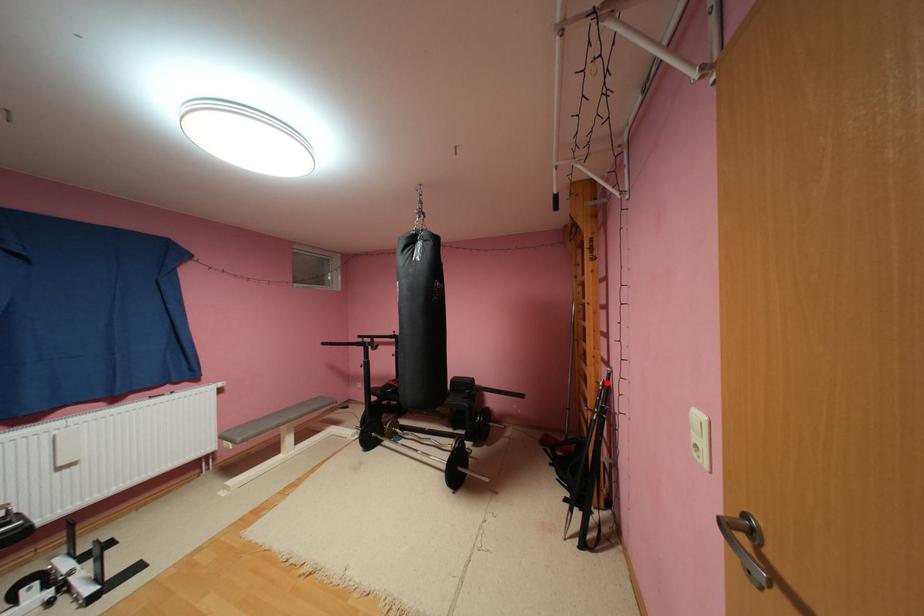
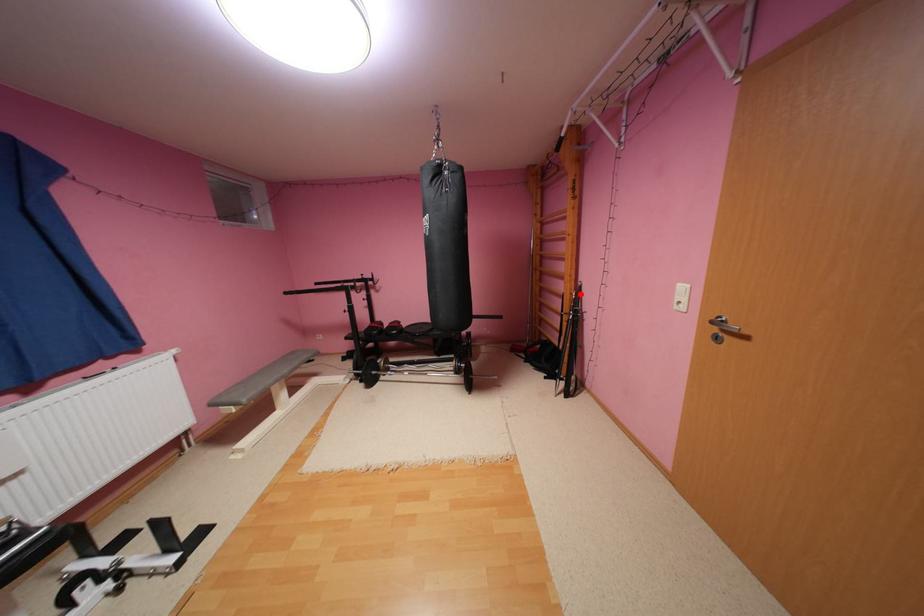
I am providing you with two images of the same scene from different viewpoints. A red point is marked on the first image and another point is marked on the second image. Do the highlighted points in image1 and image2 indicate the same real-world spot?

Yes